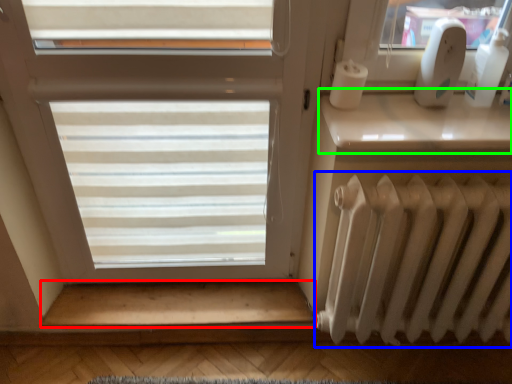
Question: Which is nearer to the stairwell (highlighted by a red box)? radiator (highlighted by a blue box) or window sill (highlighted by a green box).

Choices:
 (A) radiator
 (B) window sill

Answer: (A)